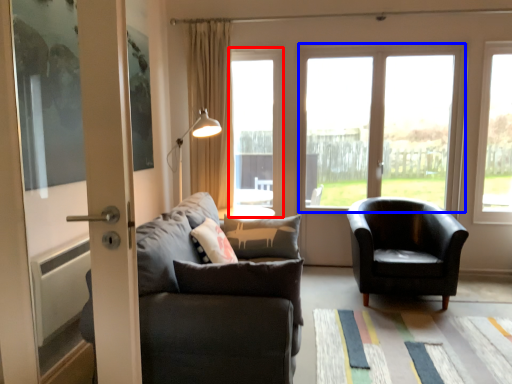
Question: Which point is closer to the camera, window (highlighted by a red box) or window (highlighted by a blue box)?

Choices:
 (A) window
 (B) window

Answer: (B)